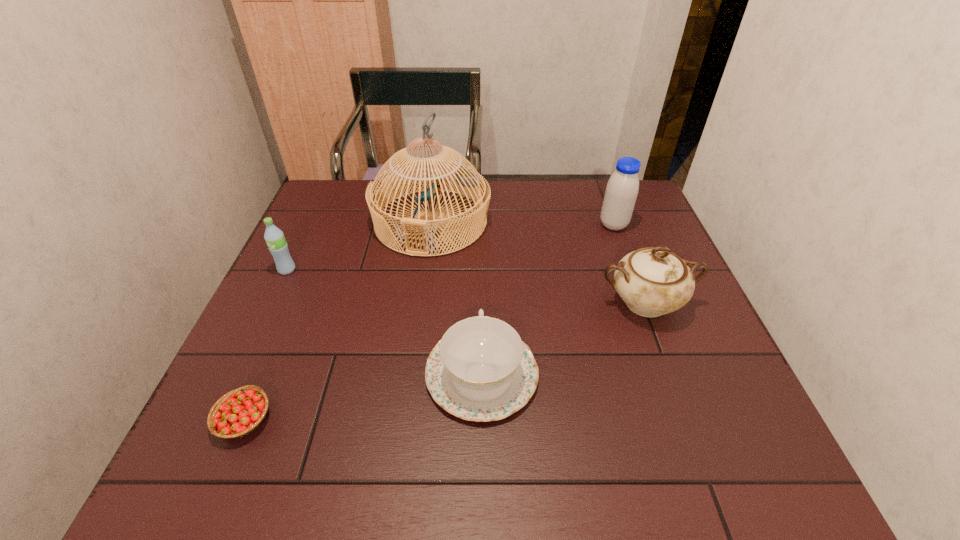
Locate an element on the screen. The image size is (960, 540). free space located 0.210m on the back of the right chinaware is located at coordinates (617, 229).

This screenshot has width=960, height=540. I want to click on free space located on the right of the water bottle, so click(x=410, y=270).

Identify the location of free location located 0.100m on the handle side of the nearer chinaware. The height and width of the screenshot is (540, 960). (482, 300).

At what (x,y) coordinates should I click in order to perform the action: click on vacant space located on the handle side of the nearer chinaware. Please return your answer as a coordinate pair (x, y). Looking at the image, I should click on (481, 237).

Image resolution: width=960 pixels, height=540 pixels. I want to click on free space located on the handle side of the nearer chinaware, so click(x=481, y=268).

Identify the location of vacant space located on the right of the strawberry. coord(440,420).

Locate an element on the screen. The width and height of the screenshot is (960, 540). birdcage located in the far edge section of the desktop is located at coordinates (466, 178).

Identify the location of soya milk positioned at the far edge. Image resolution: width=960 pixels, height=540 pixels. (622, 188).

Where is `object that is at the near edge`? The image size is (960, 540). object that is at the near edge is located at coordinates (239, 412).

This screenshot has height=540, width=960. What are the coordinates of `water bottle present at the left edge` in the screenshot? It's located at click(x=274, y=237).